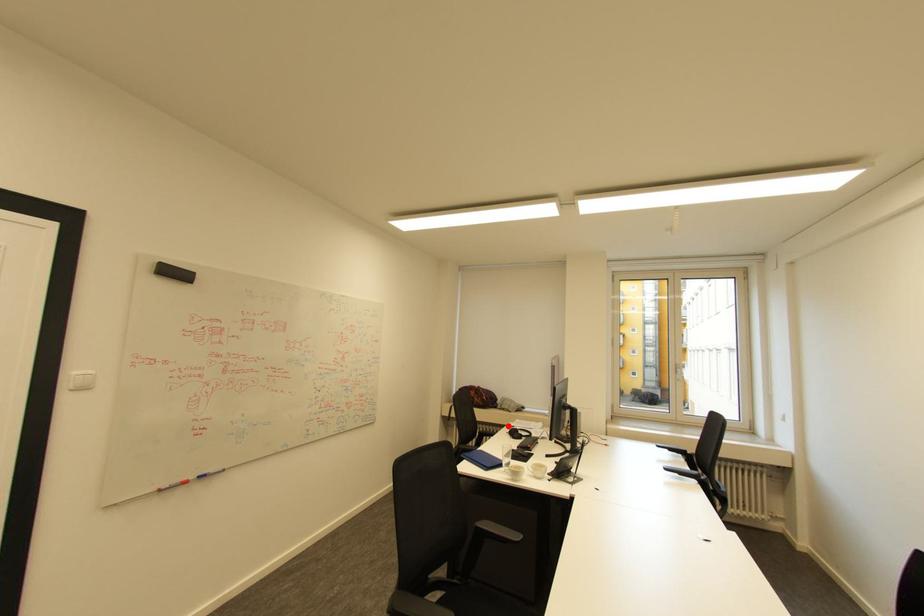
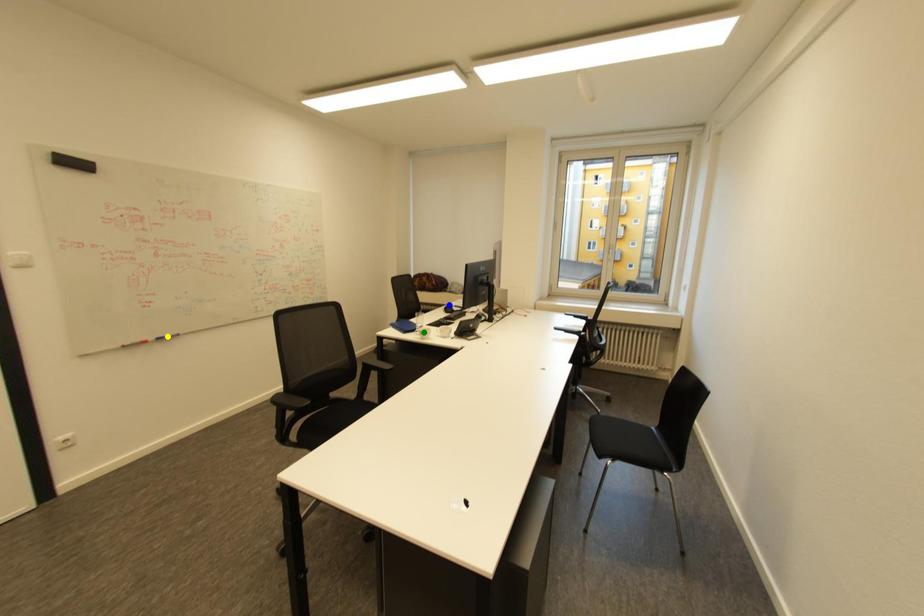
Question: I am providing you with two images of the same scene from different viewpoints. A red point is marked on the first image. You are given multiple points on the second image. Which spot in image 2 lines up with the point in image 1?

Choices:
 (A) green point
 (B) blue point
 (C) yellow point

Answer: (B)